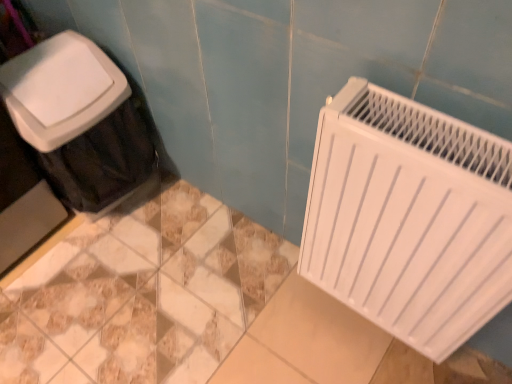
Describe the element at coordinates (409, 218) in the screenshot. This screenshot has height=384, width=512. I see `white matte radiator at right` at that location.

What is the approximate height of white matte radiator at right?

19.42 inches.

Measure the distance between point (412,218) and camera.

The distance of point (412,218) from camera is 28.78 inches.

You are a GUI agent. You are given a task and a screenshot of the screen. Output one action in this format:
    pyautogui.click(x=<x>, y=<y>)
    Task: Click on the white matte radiator at right
    The height and width of the screenshot is (384, 512).
    Given the screenshot: What is the action you would take?
    pyautogui.click(x=409, y=218)

I want to click on white plastic trash can at left, so click(79, 121).

In order to face white plastic trash can at left, should I rotate leftwards or rightwards?

You should rotate left by 21.047 degrees.

This screenshot has height=384, width=512. Describe the element at coordinates (79, 121) in the screenshot. I see `white plastic trash can at left` at that location.

Identify the location of white matte radiator at right. (409, 218).

Which is more to the right, white plastic trash can at left or white matte radiator at right?

white matte radiator at right.

Does white plastic trash can at left lie in front of white matte radiator at right?

No, it is not.

Between point (0, 88) and point (336, 137), which one is positioned in front?

The point (336, 137) is closer to the camera.

From the image's perspective, which object appears higher, white plastic trash can at left or white matte radiator at right?

white plastic trash can at left is shown above in the image.

From a real-world perspective, is white plastic trash can at left above or below white matte radiator at right?

white plastic trash can at left is below white matte radiator at right.

Looking at their sizes, would you say white plastic trash can at left is wider or thinner than white matte radiator at right?

Considering their sizes, white plastic trash can at left looks broader than white matte radiator at right.

Who is taller, white plastic trash can at left or white matte radiator at right?

white plastic trash can at left is taller.

Considering the sizes of white plastic trash can at left and white matte radiator at right in the image, is white plastic trash can at left bigger or smaller than white matte radiator at right?

white plastic trash can at left is bigger than white matte radiator at right.

Is white plastic trash can at left surrounding white matte radiator at right?

No.

Is there a large distance between white plastic trash can at left and white matte radiator at right?

Actually, white plastic trash can at left and white matte radiator at right are a little close together.

Is white plastic trash can at left oriented towards white matte radiator at right?

Yes, white plastic trash can at left is turned towards white matte radiator at right.

What's the angular difference between white plastic trash can at left and white matte radiator at right's facing directions?

89.9 degrees separate the facing orientations of white plastic trash can at left and white matte radiator at right.

How far apart are white plastic trash can at left and white matte radiator at right?

30.26 inches.

Locate an element on the screen. radiator on the right of white plastic trash can at left is located at coordinates (409, 218).

Which object is positioned more to the left, white matte radiator at right or white plastic trash can at left?

white plastic trash can at left is more to the left.

Which object is more forward, white matte radiator at right or white plastic trash can at left?

white matte radiator at right is closer to the camera.

Which point is more forward, (397, 250) or (86, 179)?

The point (397, 250) is more forward.

From the image's perspective, who appears lower, white matte radiator at right or white plastic trash can at left?

white matte radiator at right.

From a real-world perspective, is white matte radiator at right positioned over white plastic trash can at left based on gravity?

Indeed, from a real-world perspective, white matte radiator at right stands above white plastic trash can at left.

Consider the image. Can you confirm if white matte radiator at right is thinner than white plastic trash can at left?

Indeed, white matte radiator at right has a lesser width compared to white plastic trash can at left.

Can you confirm if white matte radiator at right is taller than white plastic trash can at left?

In fact, white matte radiator at right may be shorter than white plastic trash can at left.

Is white matte radiator at right bigger or smaller than white plastic trash can at left?

In the image, white matte radiator at right appears to be smaller than white plastic trash can at left.

Is white matte radiator at right located outside white plastic trash can at left?

Indeed, white matte radiator at right is completely outside white plastic trash can at left.

Is white matte radiator at right directly adjacent to white plastic trash can at left?

No, white matte radiator at right is not beside white plastic trash can at left.

Is white plastic trash can at left at the back of white matte radiator at right?

No.

How many degrees apart are the facing directions of white matte radiator at right and white plastic trash can at left?

The facing directions of white matte radiator at right and white plastic trash can at left are 89.9 degrees apart.

At what (x,y) coordinates should I click in order to perform the action: click on radiator in front of the white plastic trash can at left. Please return your answer as a coordinate pair (x, y). Image resolution: width=512 pixels, height=384 pixels. Looking at the image, I should click on (409, 218).

At what (x,y) coordinates should I click in order to perform the action: click on waste container located on the left of white matte radiator at right. Please return your answer as a coordinate pair (x, y). The height and width of the screenshot is (384, 512). Looking at the image, I should click on (79, 121).

Where is `waste container behind the white matte radiator at right`? Image resolution: width=512 pixels, height=384 pixels. waste container behind the white matte radiator at right is located at coordinates (79, 121).